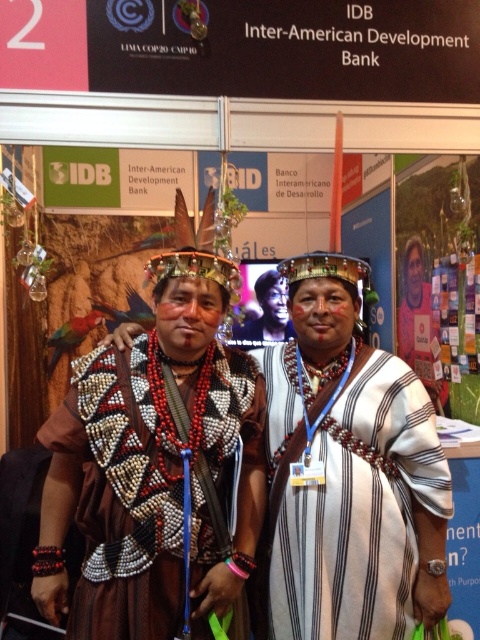
You are an anthropologist observing the attire of the two individuals in the image. Which object, the matte brown feathers at center or the white striped fabric at center, is positioned higher on the person on the left?

The matte brown feathers at center is located above the white striped fabric at center, so the matte brown feathers at center is positioned higher on the person on the left.